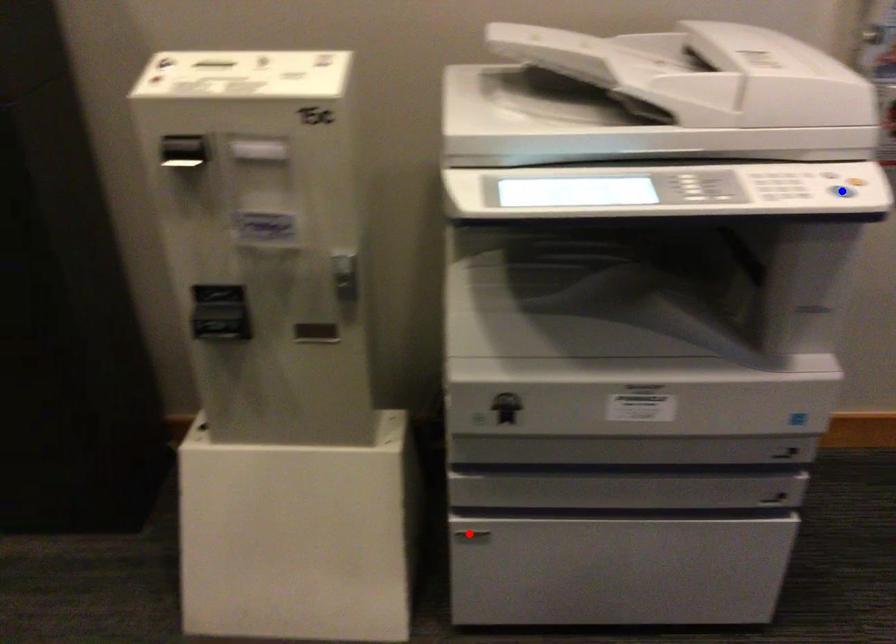
Question: Which of the two points in the image is closer to the camera?

Choices:
 (A) Blue point is closer.
 (B) Red point is closer.

Answer: (A)